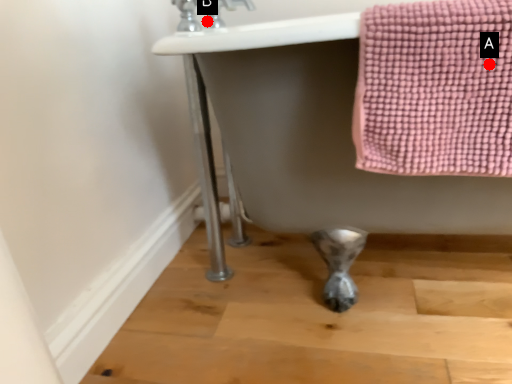
Question: Two points are circled on the image, labeled by A and B beside each circle. Which of the following is the closest to the observer?

Choices:
 (A) A is closer
 (B) B is closer

Answer: (A)